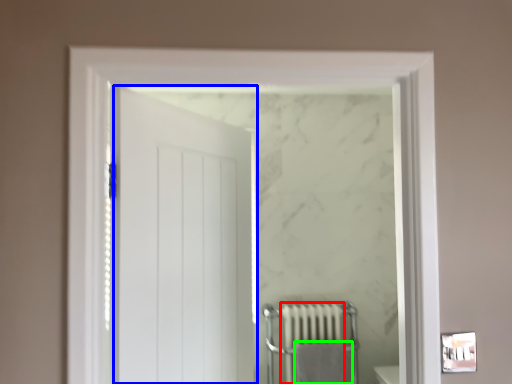
Question: Which object is positioned closest to radiator (highlighted by a red box)? Select from door (highlighted by a blue box) and bath towel (highlighted by a green box).

Choices:
 (A) door
 (B) bath towel

Answer: (B)